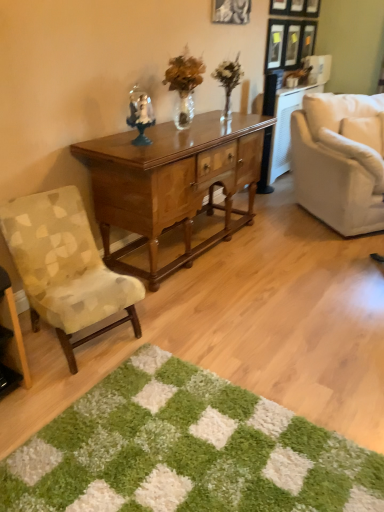
I want to click on free location in front of patterned fabric chair at left, which ranks as the second chair in top-to-bottom order, so click(42, 392).